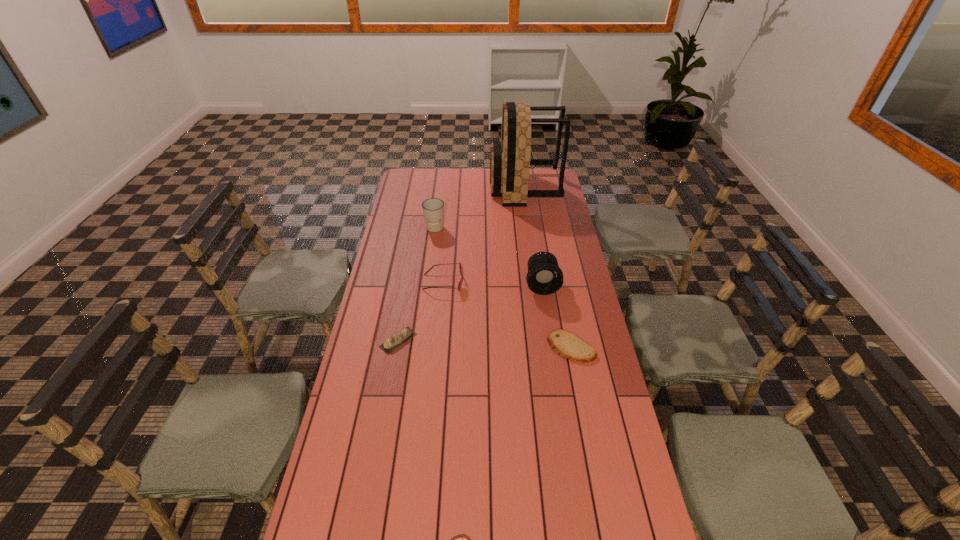
Locate an element on the screen. vacant region that satisfies the following two spatial constraints: 1. with a handle on the side of the cup; 2. on the left side of the rightmost pita bread is located at coordinates (420, 347).

This screenshot has width=960, height=540. Find the location of `vacant space that satisfies the following two spatial constraints: 1. on the front-facing side of the sunglasses; 2. on the right side of the rightmost pita bread`. vacant space that satisfies the following two spatial constraints: 1. on the front-facing side of the sunglasses; 2. on the right side of the rightmost pita bread is located at coordinates (438, 347).

At what (x,y) coordinates should I click in order to perform the action: click on free space that satisfies the following two spatial constraints: 1. with a handle on the side of the rightmost pita bread; 2. on the right side of the second farthest object. Please return your answer as a coordinate pair (x, y). Looking at the image, I should click on (420, 347).

You are a GUI agent. You are given a task and a screenshot of the screen. Output one action in this format:
    pyautogui.click(x=<x>, y=<y>)
    Task: Click on the blank space that satisfies the following two spatial constraints: 1. with a handle on the side of the second farthest object; 2. on the right side of the rightmost pita bread
    The image size is (960, 540).
    Given the screenshot: What is the action you would take?
    pyautogui.click(x=420, y=347)